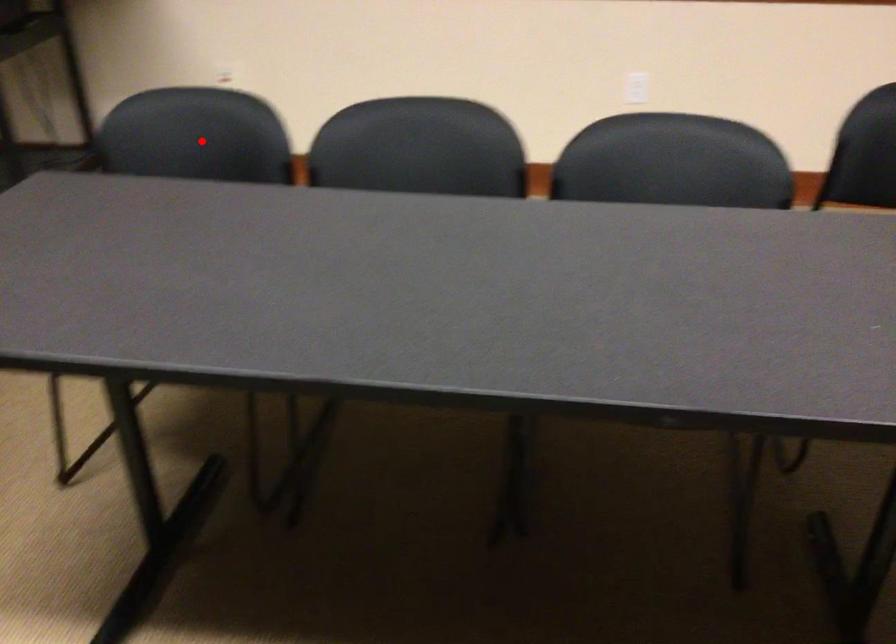
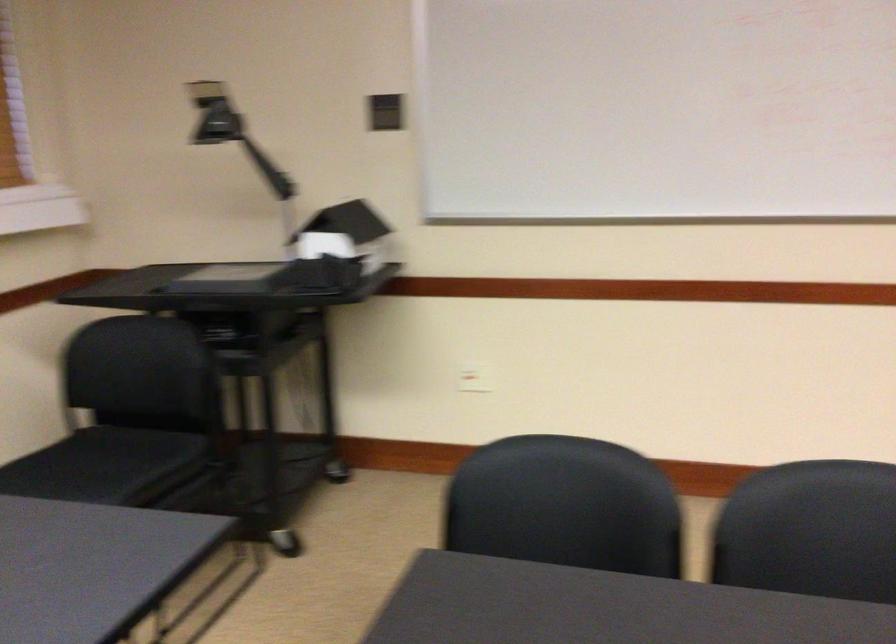
Question: A red point is marked in image1. In image2, is the corresponding 3D point closer to the camera or farther? Reply with the corresponding letter.

Choices:
 (A) The corresponding 3D point is closer.
 (B) The corresponding 3D point is farther.

Answer: (A)